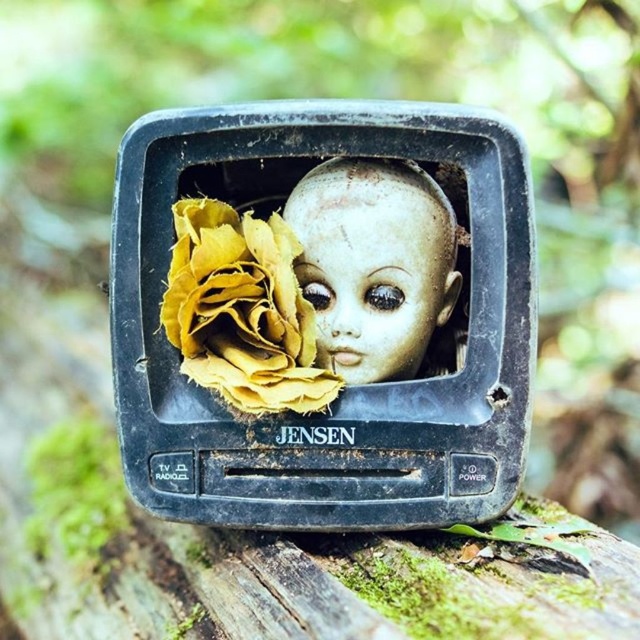
Which is above, yellow crumpled paper at center or pale porcelain face at center?

Positioned higher is pale porcelain face at center.

Which of these two, yellow crumpled paper at center or pale porcelain face at center, stands shorter?

pale porcelain face at center

Who is more distant from viewer, [307,362] or [384,372]?

The point [384,372] is more distant.

This screenshot has height=640, width=640. I want to click on yellow crumpled paper at center, so click(243, 310).